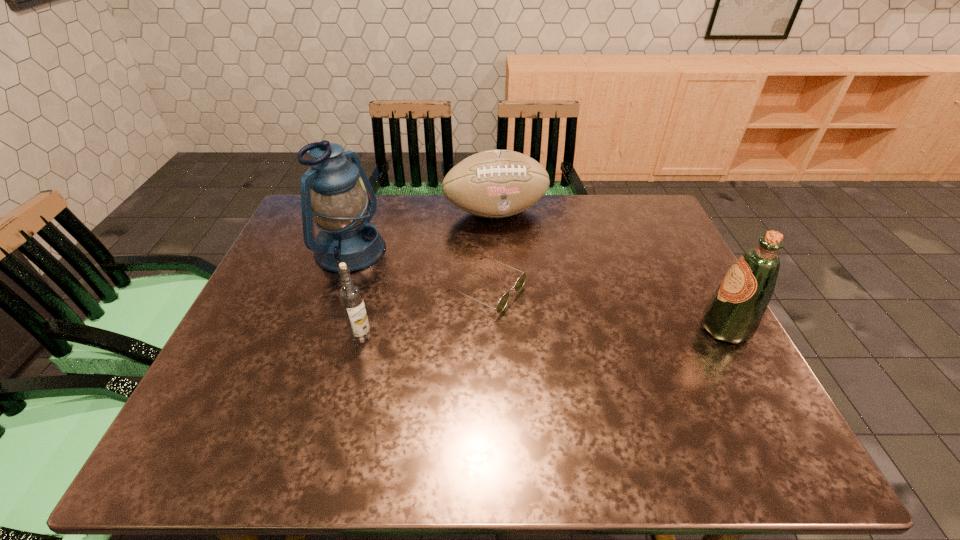
What are the coordinates of `vodka` in the screenshot? It's located at (350, 295).

Identify the location of olive oil. (734, 312).

Locate an element on the screen. This screenshot has width=960, height=540. the rightmost object is located at coordinates (734, 312).

What are the coordinates of `the shortest object` in the screenshot? It's located at (502, 303).

The width and height of the screenshot is (960, 540). What are the coordinates of `lantern` in the screenshot? It's located at (342, 209).

Identify the location of football (American). (497, 183).

The width and height of the screenshot is (960, 540). Find the location of `vacant space located 0.150m on the label of the vodka`. vacant space located 0.150m on the label of the vodka is located at coordinates (345, 401).

Locate an element on the screen. The height and width of the screenshot is (540, 960). vacant position located on the front-facing side of the olive oil is located at coordinates (556, 328).

The image size is (960, 540). I want to click on blank space located on the front-facing side of the olive oil, so point(539,328).

The height and width of the screenshot is (540, 960). Find the location of `vacant space located on the front-facing side of the olive oil`. vacant space located on the front-facing side of the olive oil is located at coordinates (610, 328).